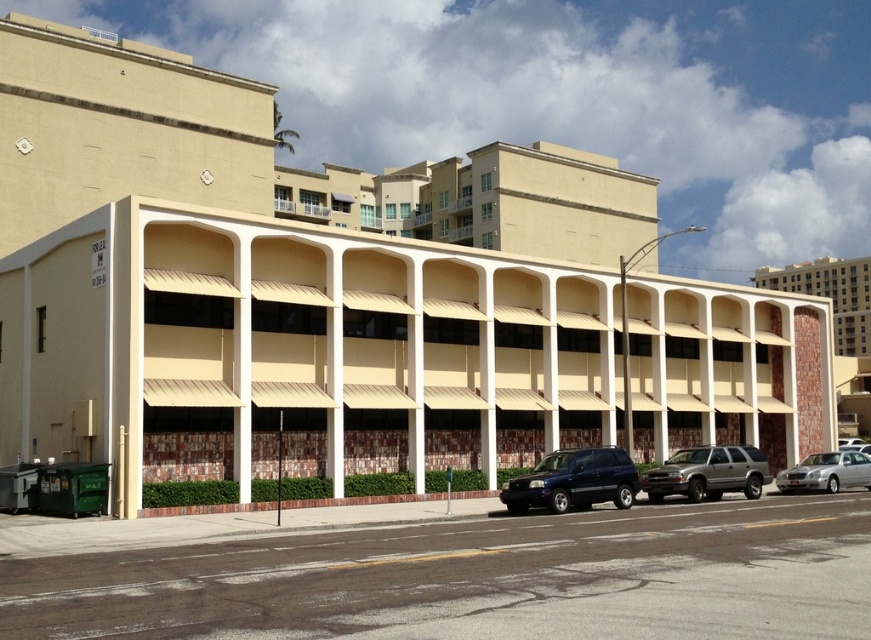
Looking at this image, can you confirm if shiny dark blue suv at center is wider than satin silver suv at center?

Indeed, shiny dark blue suv at center has a greater width compared to satin silver suv at center.

Locate an element on the screen. This screenshot has width=871, height=640. shiny dark blue suv at center is located at coordinates (574, 481).

Locate an element on the screen. This screenshot has height=640, width=871. shiny dark blue suv at center is located at coordinates (574, 481).

In order to click on shiny dark blue suv at center in this screenshot , I will do `click(574, 481)`.

Who is more distant from viewer, (760,275) or (825,452)?

The point (760,275) is more distant.

Does beige brick building at upper right have a smaller size compared to silver metallic sedan at lower right?

No.

Who is more distant from viewer, (790, 275) or (839, 477)?

The point (790, 275) is more distant.

At what (x,y) coordinates should I click in order to perform the action: click on beige brick building at upper right. Please return your answer as a coordinate pair (x, y). Looking at the image, I should click on (829, 294).

What do you see at coordinates (707, 474) in the screenshot? This screenshot has width=871, height=640. I see `satin silver suv at center` at bounding box center [707, 474].

Does satin silver suv at center have a lesser height compared to silver metallic sedan at lower right?

Yes.

Between point (719, 445) and point (868, 461), which one is positioned behind?

Point (719, 445)

The height and width of the screenshot is (640, 871). I want to click on satin silver suv at center, so click(707, 474).